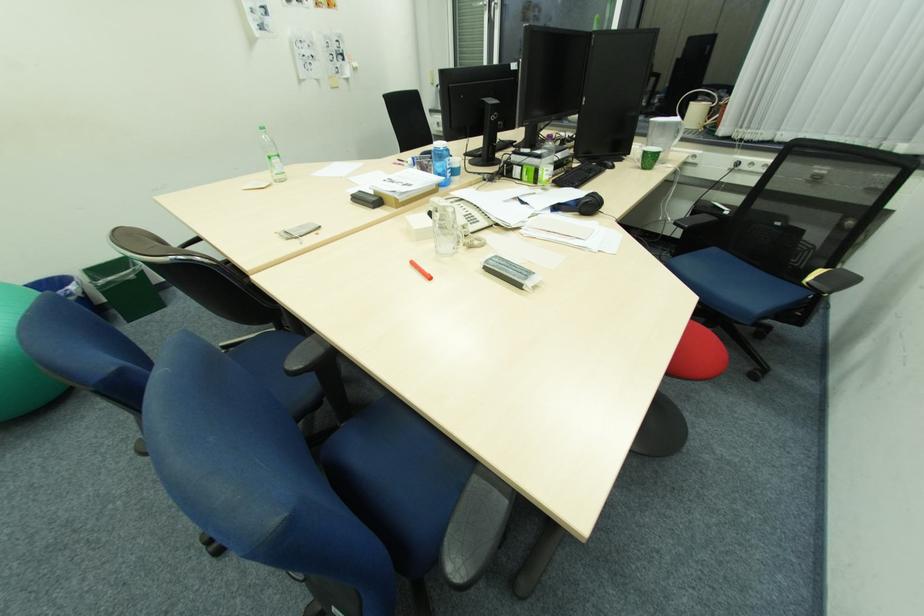
Find where to lift the blue water bottle. Please return your answer as a coordinate pair (x, y).

(441, 161)